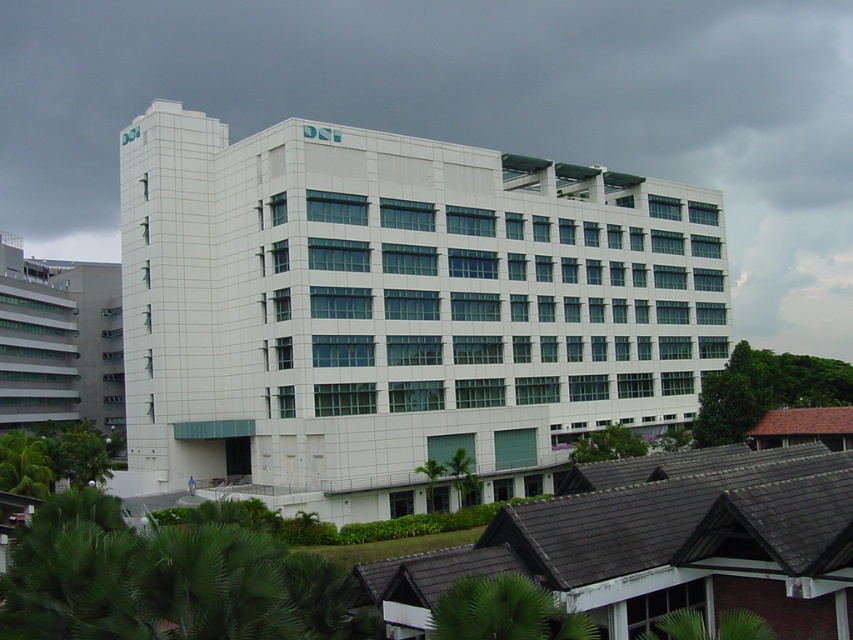
Question: Is white tile building at center smaller than white smooth building at left?

Choices:
 (A) yes
 (B) no

Answer: (B)

Question: Is white tile building at center bigger than white smooth building at left?

Choices:
 (A) no
 (B) yes

Answer: (B)

Question: Can you confirm if white tile building at center is positioned above white smooth building at left?

Choices:
 (A) no
 (B) yes

Answer: (B)

Question: Which of the following is the farthest from the observer?

Choices:
 (A) white tile building at center
 (B) white smooth building at left

Answer: (B)